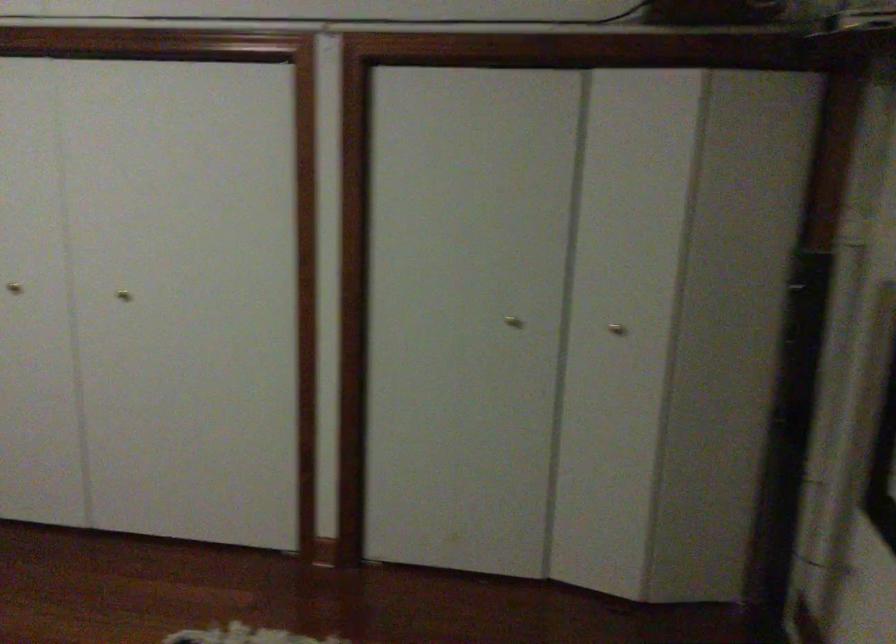
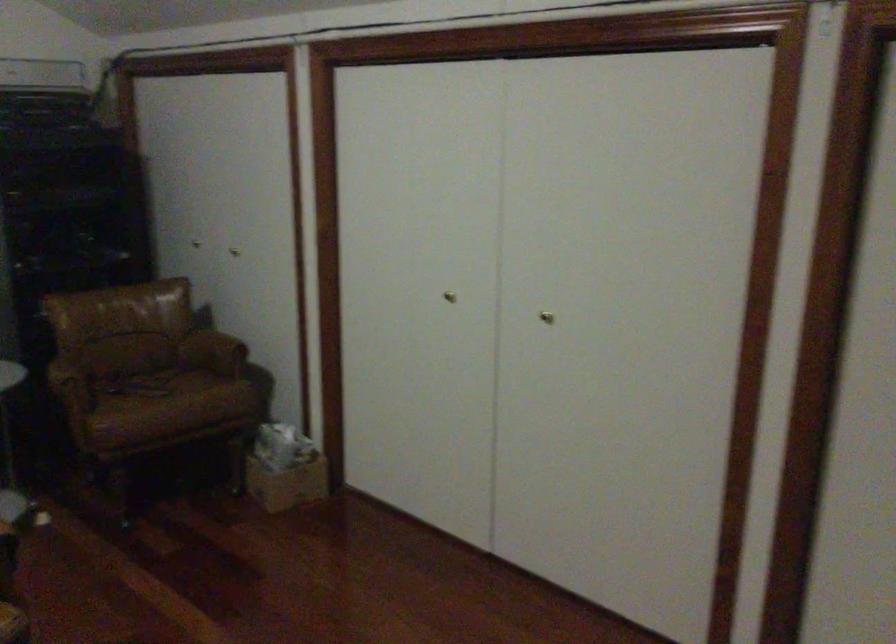
Locate, in the second image, the point that corresponds to pixel 124 294 in the first image.

(546, 317)